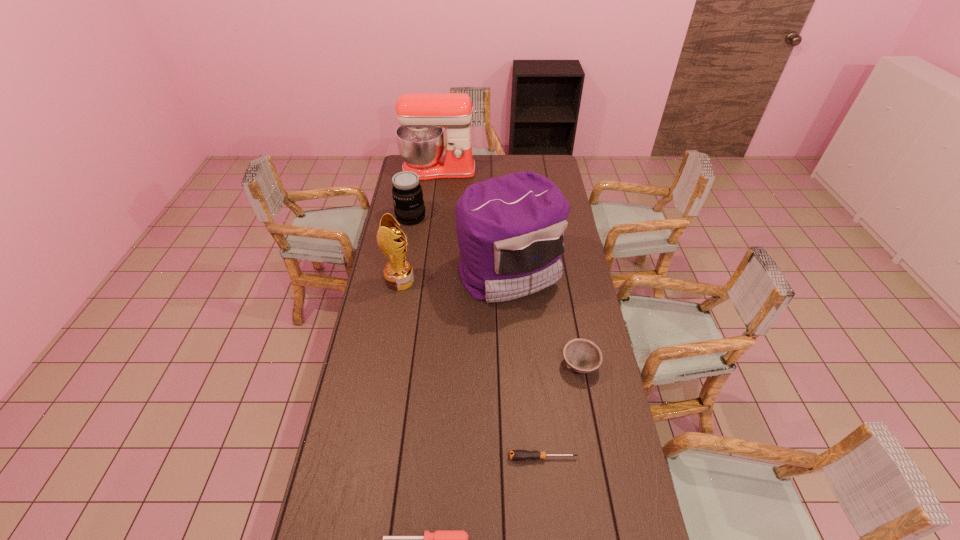
Locate an element on the screen. Image resolution: width=960 pixels, height=540 pixels. mixer is located at coordinates (420, 138).

What are the coordinates of `backpack` in the screenshot? It's located at (510, 230).

Identify the location of award. The image size is (960, 540). (398, 273).

Image resolution: width=960 pixels, height=540 pixels. Identify the location of the second farthest object. (407, 193).

Find the location of a particular element. This screenshot has width=960, height=540. telephoto lens is located at coordinates (407, 193).

What are the coordinates of `bowl` in the screenshot? It's located at (583, 356).

Where is `the fifth farthest object`? Image resolution: width=960 pixels, height=540 pixels. the fifth farthest object is located at coordinates (583, 356).

Where is `the farther screwdriver`? This screenshot has width=960, height=540. the farther screwdriver is located at coordinates (520, 455).

The image size is (960, 540). What are the coordinates of `the right screwdriver` in the screenshot? It's located at (520, 455).

In order to click on free location located on the front-facing side of the farthest object in this screenshot , I will do `click(436, 187)`.